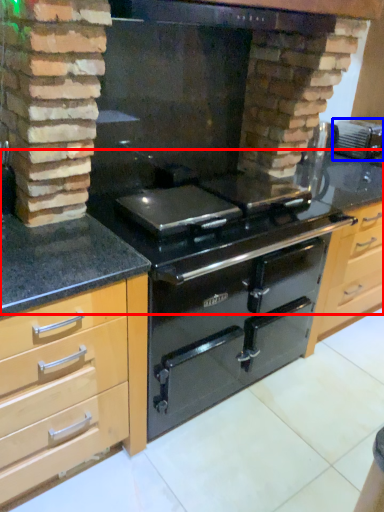
Question: Which of the following is the farthest to the observer, counter top (highlighted by a red box) or appliance (highlighted by a blue box)?

Choices:
 (A) counter top
 (B) appliance

Answer: (B)